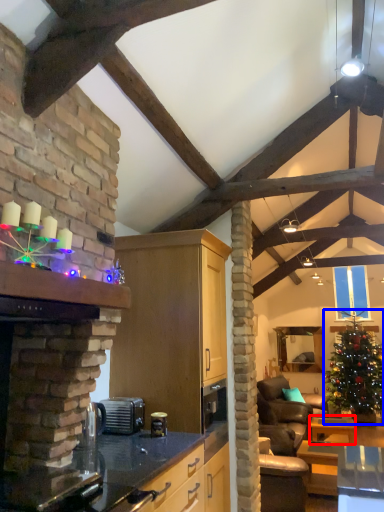
Question: Which of the following is the closest to the observer, table (highlighted by a red box) or christmas tree (highlighted by a blue box)?

Choices:
 (A) table
 (B) christmas tree

Answer: (A)